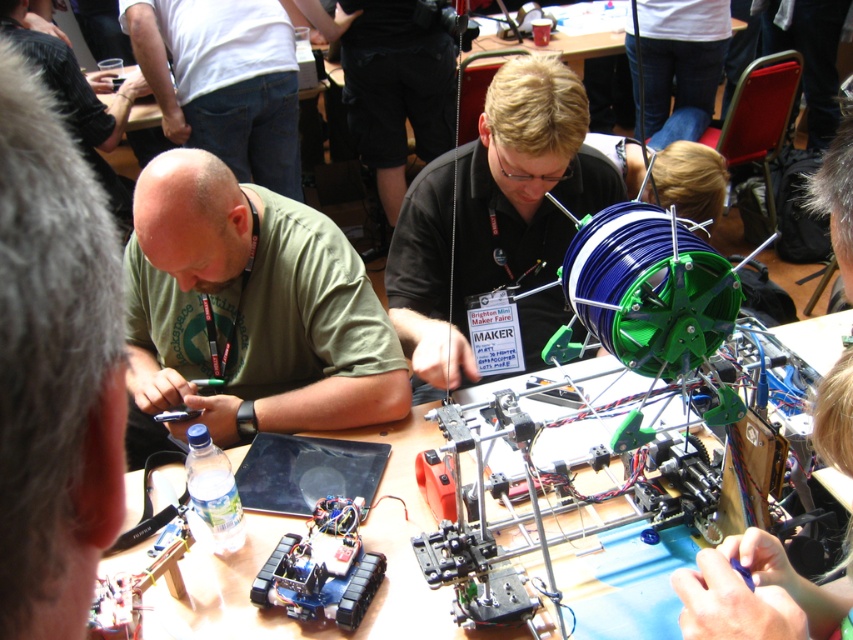
Is point (135, 339) positioned before point (250, 515)?

No, it is behind (250, 515).

Between green matte shirt at center and wooden table at center, which one is positioned higher?

green matte shirt at center is above.

The image size is (853, 640). In order to click on green matte shirt at center in this screenshot , I will do `click(251, 307)`.

Who is taller, green matte spool at center or wooden table at center?

green matte spool at center is taller.

Does green matte spool at center come behind wooden table at center?

Yes, it is behind wooden table at center.

Is point (537, 68) behind point (219, 620)?

Yes, it is behind point (219, 620).

Find the location of a particular element. The width and height of the screenshot is (853, 640). green matte spool at center is located at coordinates (492, 212).

Is green matte shirt at center behind green matte spool at center?

That is False.

Is point (223, 362) farther from camera compared to point (440, 369)?

Yes, point (223, 362) is farther from viewer.

Who is more distant from viewer, (204, 184) or (492, 145)?

Positioned behind is point (492, 145).

The height and width of the screenshot is (640, 853). I want to click on green matte shirt at center, so click(251, 307).